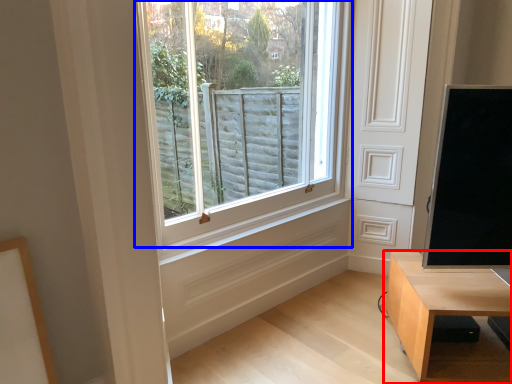
Question: Which object is further to the camera taking this photo, table (highlighted by a red box) or window (highlighted by a blue box)?

Choices:
 (A) table
 (B) window

Answer: (B)